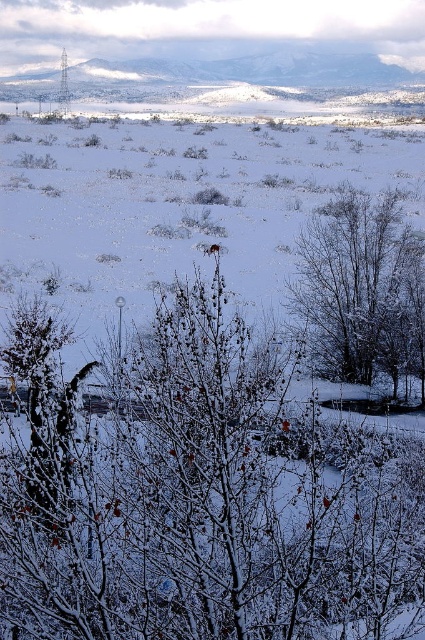
You are standing at the base of the trees in the winter landscape scene. You want to place a small decoration exactly at the point with coordinates point (201, 497). Where should you place it?

The point (201, 497) is located on the snow covered branches at center, so you should place the decoration on the snow covered branches at center.